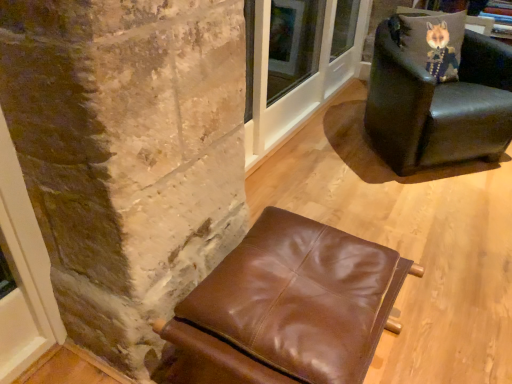
At what (x,y) coordinates should I click in order to perform the action: click on free spot to the right of brown leather ottoman at lower center, arranged as the 1th chair when viewed from the front. Please return your answer as a coordinate pair (x, y). This screenshot has height=384, width=512. Looking at the image, I should click on (442, 323).